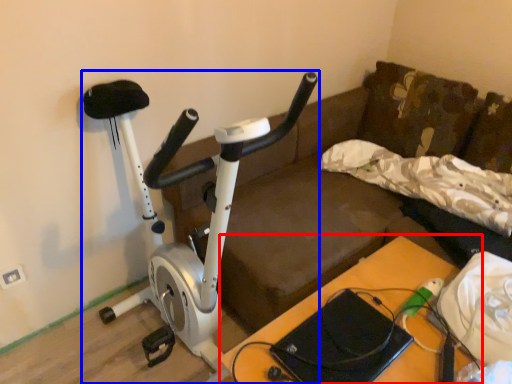
Question: Which point is closer to the camera, table (highlighted by a red box) or stationary bicycle (highlighted by a blue box)?

Choices:
 (A) table
 (B) stationary bicycle

Answer: (B)